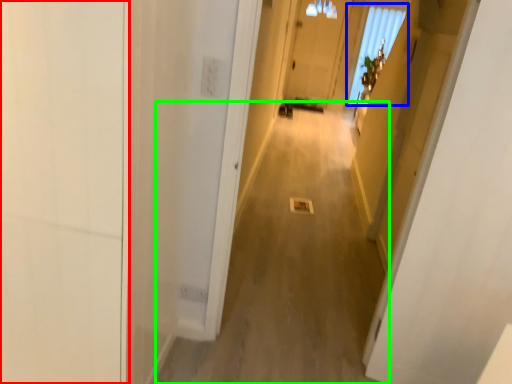
Question: Based on their relative distances, which object is nearer to door (highlighted by a red box)? Choose from window (highlighted by a blue box) and alley (highlighted by a green box).

Choices:
 (A) window
 (B) alley

Answer: (B)